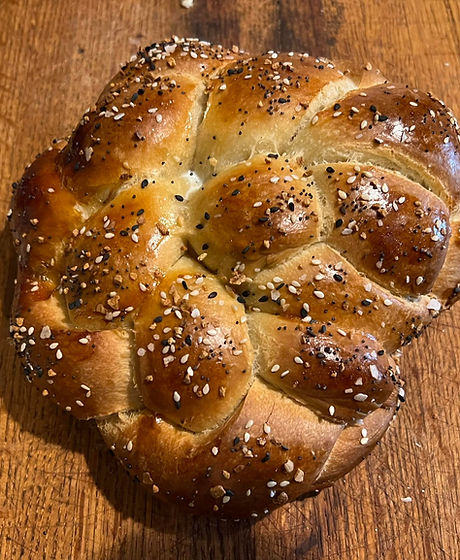
Identify the location of open brown space of tabletop, lower left. The image size is (460, 560). (123, 540), (24, 534).